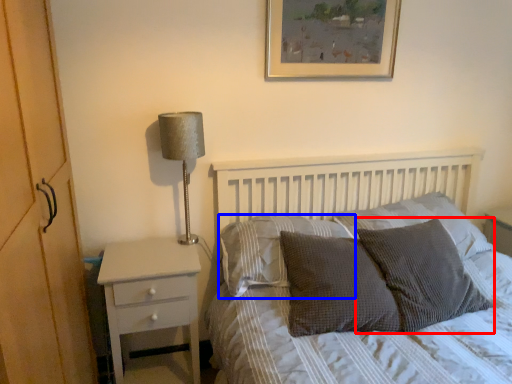
Question: Among these objects, which one is farthest to the camera, pillow (highlighted by a red box) or pillow (highlighted by a blue box)?

Choices:
 (A) pillow
 (B) pillow

Answer: (B)